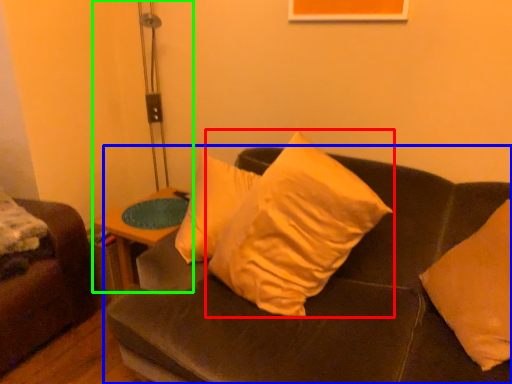
Question: Which object is positioned closest to pillow (highlighted by a red box)? Select from studio couch (highlighted by a blue box) and table lamp (highlighted by a green box).

Choices:
 (A) studio couch
 (B) table lamp

Answer: (A)